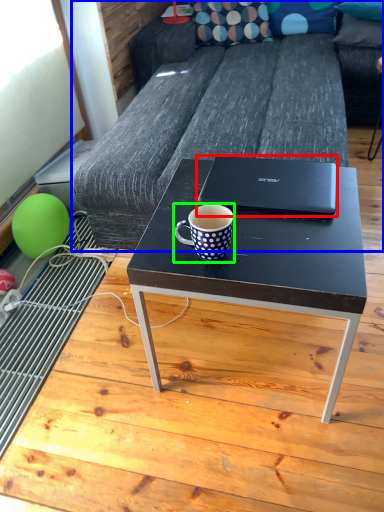
Question: Which object is the farthest from laptop (highlighted by a red box)? Choose among these: studio couch (highlighted by a blue box) or coffee cup (highlighted by a green box).

Choices:
 (A) studio couch
 (B) coffee cup

Answer: (A)